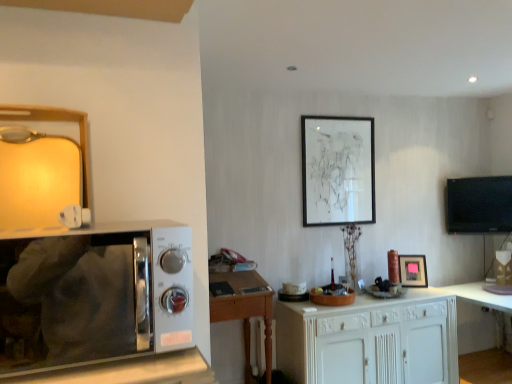
Question: Would you say white glossy table at lower right is outside black glossy tv at right?

Choices:
 (A) no
 (B) yes

Answer: (B)

Question: From a real-world perspective, does white glossy table at lower right stand above black glossy tv at right?

Choices:
 (A) no
 (B) yes

Answer: (A)

Question: Can you confirm if white glossy table at lower right is positioned to the right of black glossy tv at right?

Choices:
 (A) yes
 (B) no

Answer: (A)

Question: From a real-world perspective, is white glossy table at lower right physically below black glossy tv at right?

Choices:
 (A) no
 (B) yes

Answer: (B)

Question: Does white glossy table at lower right lie behind black glossy tv at right?

Choices:
 (A) yes
 (B) no

Answer: (B)

Question: Does white glossy table at lower right have a lesser width compared to black glossy tv at right?

Choices:
 (A) yes
 (B) no

Answer: (B)

Question: From the image's perspective, is white wood cabinet at center below sleek silver microwave at left?

Choices:
 (A) yes
 (B) no

Answer: (A)

Question: From a real-world perspective, is white wood cabinet at center on top of sleek silver microwave at left?

Choices:
 (A) yes
 (B) no

Answer: (B)

Question: From the image's perspective, is white wood cabinet at center on sleek silver microwave at left?

Choices:
 (A) yes
 (B) no

Answer: (B)

Question: Is white wood cabinet at center in front of sleek silver microwave at left?

Choices:
 (A) no
 (B) yes

Answer: (A)

Question: Can you confirm if white wood cabinet at center is smaller than sleek silver microwave at left?

Choices:
 (A) yes
 (B) no

Answer: (B)

Question: Is white wood cabinet at center facing away from sleek silver microwave at left?

Choices:
 (A) no
 (B) yes

Answer: (A)

Question: Does white wood cabinet at center have a smaller size compared to matte black picture frame at center, which is counted as the 2th picture frame, starting from the left?

Choices:
 (A) no
 (B) yes

Answer: (A)